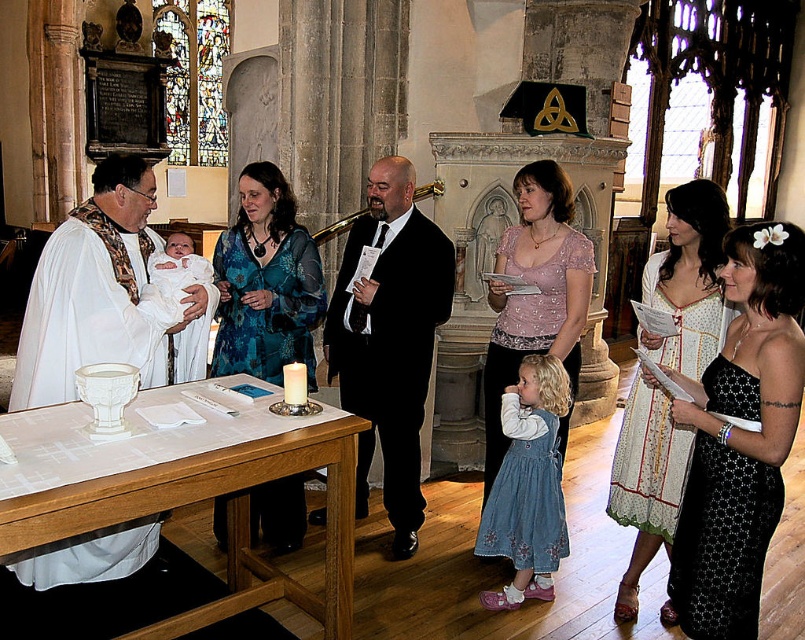
Based on the scene description, can you determine which object occupies more space in the image between the white wood altar at lower left and the pale pink lace blouse at center?

The white wood altar at lower left is bigger than the pale pink lace blouse at center, so it occupies more space in the image.

You are standing in the church and want to place a small flower bouquet at the point marked as point (762,408). If you are currently 3 meters away from that point, can you reach it without moving closer?

The point (762,408) is 3.38 meters from the viewer. Since you are currently 3 meters away, you are already closer than the required distance, so you can reach it without moving closer.